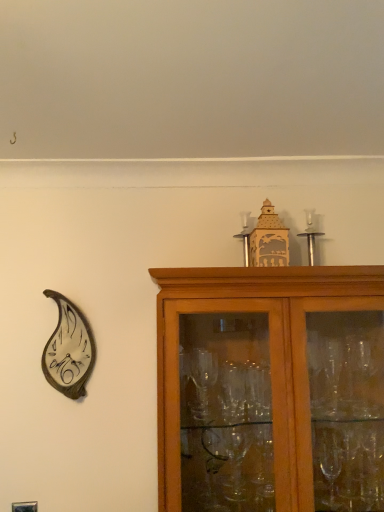
Question: Is metallic leaf-shaped clock at left surrounded by silver metallic candle holder at upper center, which is the second candle holder from left to right?

Choices:
 (A) no
 (B) yes

Answer: (A)

Question: Is silver metallic candle holder at upper center, which is the second candle holder from left to right, closer to the viewer compared to metallic leaf-shaped clock at left?

Choices:
 (A) no
 (B) yes

Answer: (A)

Question: Is silver metallic candle holder at upper center, the first candle holder in the right-to-left sequence, completely or partially outside of metallic leaf-shaped clock at left?

Choices:
 (A) yes
 (B) no

Answer: (A)

Question: From a real-world perspective, is silver metallic candle holder at upper center, which is the second candle holder from left to right, physically below metallic leaf-shaped clock at left?

Choices:
 (A) yes
 (B) no

Answer: (B)

Question: Can you confirm if silver metallic candle holder at upper center, the first candle holder in the right-to-left sequence, is smaller than metallic leaf-shaped clock at left?

Choices:
 (A) yes
 (B) no

Answer: (A)

Question: Considering the relative sizes of silver metallic candle holder at upper center, the first candle holder in the right-to-left sequence, and metallic leaf-shaped clock at left in the image provided, is silver metallic candle holder at upper center, the first candle holder in the right-to-left sequence, wider than metallic leaf-shaped clock at left?

Choices:
 (A) no
 (B) yes

Answer: (A)

Question: Does brown wooden cabinet at upper right have a larger size compared to metallic leaf-shaped clock at left?

Choices:
 (A) no
 (B) yes

Answer: (B)

Question: From a real-world perspective, is brown wooden cabinet at upper right positioned under metallic leaf-shaped clock at left based on gravity?

Choices:
 (A) no
 (B) yes

Answer: (B)

Question: Considering the relative sizes of brown wooden cabinet at upper right and metallic leaf-shaped clock at left in the image provided, is brown wooden cabinet at upper right thinner than metallic leaf-shaped clock at left?

Choices:
 (A) yes
 (B) no

Answer: (B)

Question: Can you confirm if brown wooden cabinet at upper right is smaller than metallic leaf-shaped clock at left?

Choices:
 (A) yes
 (B) no

Answer: (B)

Question: Is brown wooden cabinet at upper right aimed at metallic leaf-shaped clock at left?

Choices:
 (A) no
 (B) yes

Answer: (A)

Question: From the image's perspective, is brown wooden cabinet at upper right on metallic leaf-shaped clock at left?

Choices:
 (A) yes
 (B) no

Answer: (B)

Question: Is silver metallic candle holder at upper center, acting as the 1th candle holder starting from the left, outside silver metallic candle holder at upper center, which is the second candle holder from left to right?

Choices:
 (A) no
 (B) yes

Answer: (B)